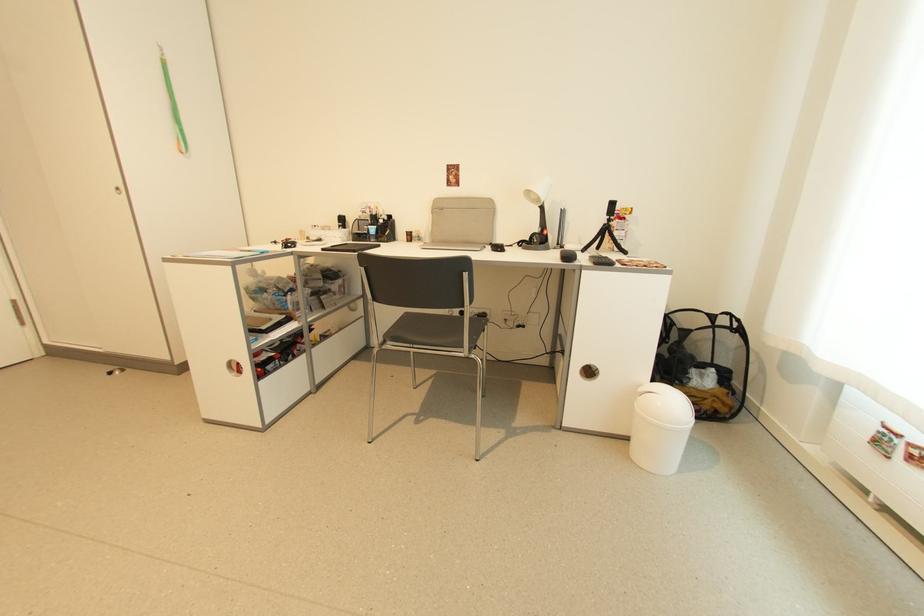
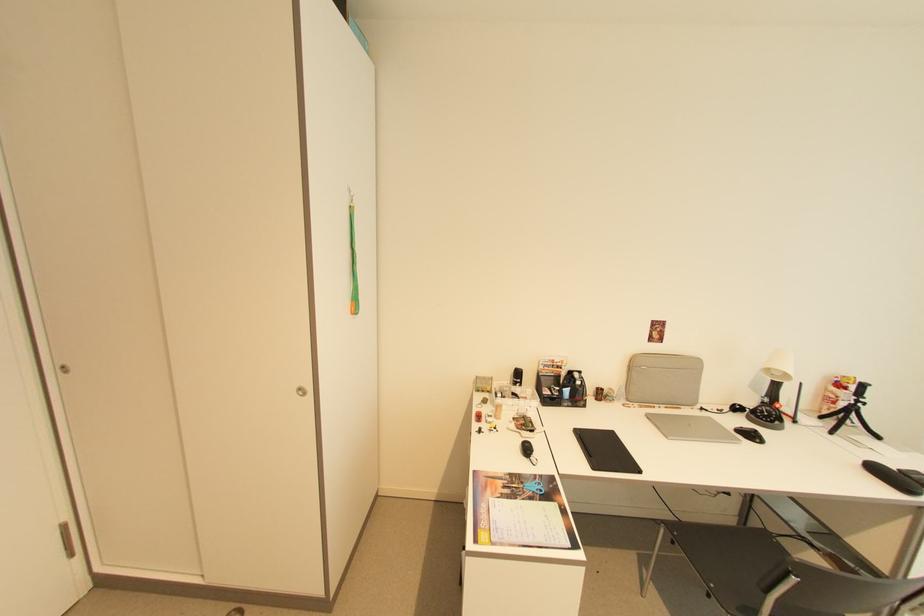
In the second image, find the point that corresponds to point (612, 224) in the first image.

(857, 405)